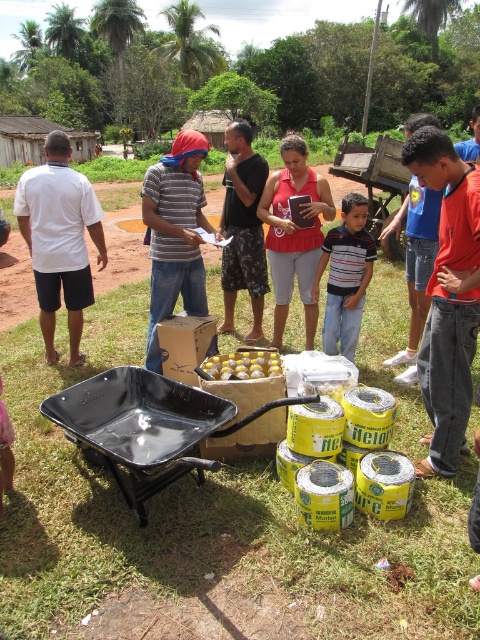
Question: Considering the real-world distances, which object is farthest from the wooden cart at center?

Choices:
 (A) yellow matte plastic eggs at center
 (B) black plastic cart at center

Answer: (B)

Question: Does matte pink tank top at center appear over striped cotton shirt at center?

Choices:
 (A) yes
 (B) no

Answer: (A)

Question: Is black plastic cart at center positioned at the back of white matte shirt at left?

Choices:
 (A) no
 (B) yes

Answer: (A)

Question: Which of the following is the closest to the observer?

Choices:
 (A) (358, 147)
 (B) (168, 413)
 (C) (72, 246)

Answer: (B)

Question: Does white matte shirt at left have a smaller size compared to striped cotton shirt at center?

Choices:
 (A) yes
 (B) no

Answer: (A)

Question: Which object appears closest to the camera in this image?

Choices:
 (A) striped shirt at center
 (B) striped cotton shirt at center
 (C) black plastic cart at center

Answer: (C)